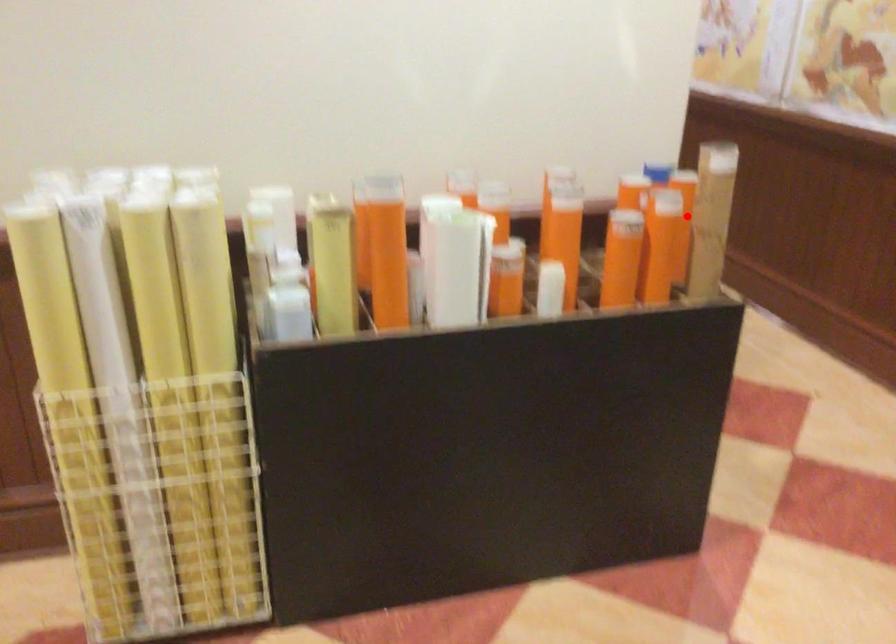
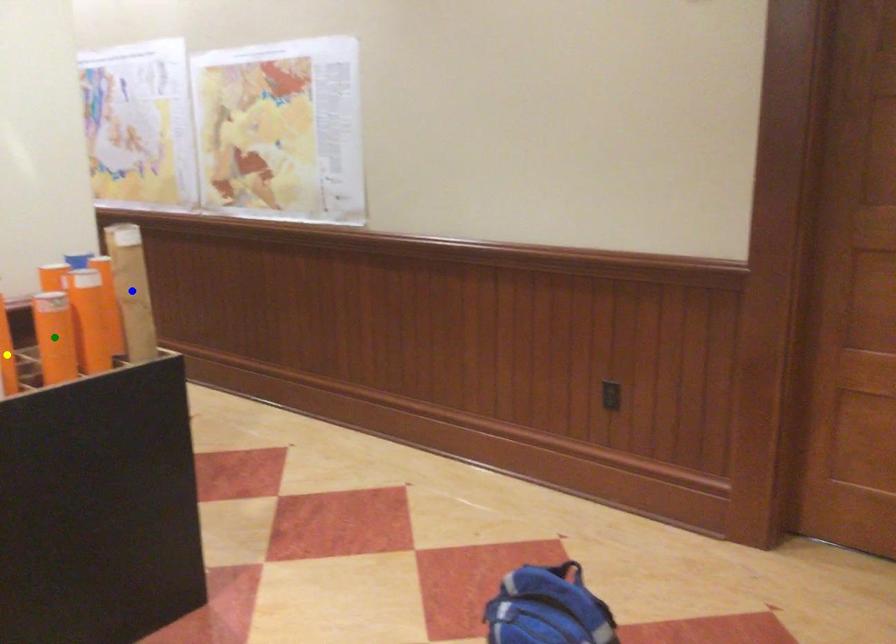
Question: I am providing you with two images of the same scene from different viewpoints. A red point is marked on the first image. You are given multiple points on the second image. Which point in image 2 is actually the same real-world point as the red point in image 1?

Choices:
 (A) blue point
 (B) green point
 (C) yellow point

Answer: (A)